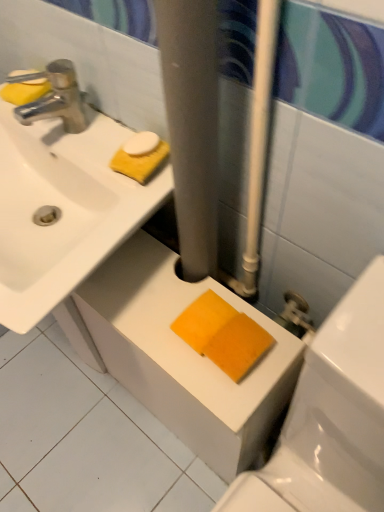
In order to click on free location in front of yellow sponge at upper left, the 2th soap in the top-to-bottom sequence in this screenshot , I will do `click(59, 135)`.